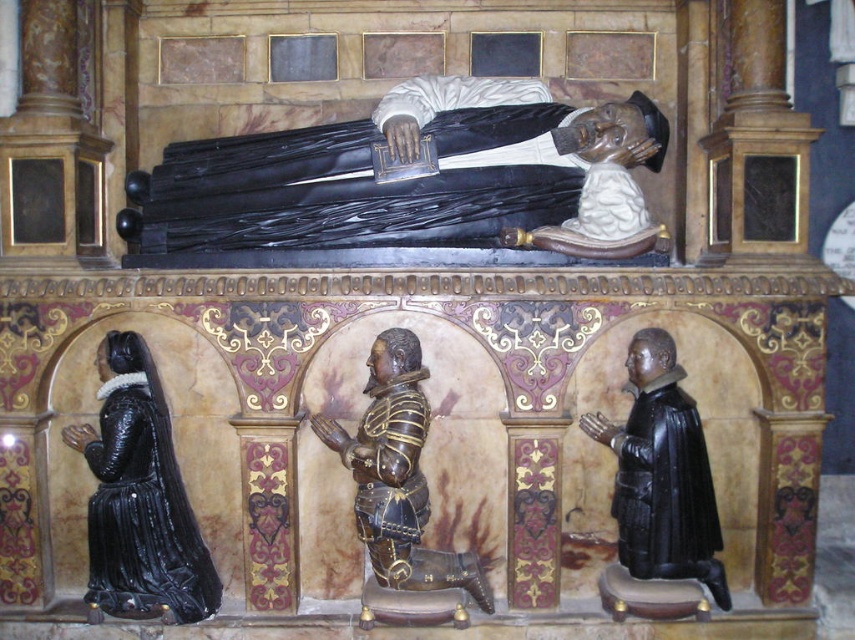
Question: Does black glossy statue at lower left have a smaller size compared to black polished wood statue at center?

Choices:
 (A) yes
 (B) no

Answer: (B)

Question: Among these points, which one is nearest to the camera?

Choices:
 (A) (174, 593)
 (B) (133, 243)

Answer: (A)

Question: Which point is farther to the camera?

Choices:
 (A) (349, 435)
 (B) (155, 548)

Answer: (A)

Question: Does black glossy statue at lower left appear under black polished wood statue at center?

Choices:
 (A) no
 (B) yes

Answer: (B)

Question: Which of these objects is positioned closest to the matte black statue at center?

Choices:
 (A) black polished wood statue at center
 (B) black glossy statue at lower left

Answer: (B)

Question: Can you confirm if matte black statue at center is smaller than black polished wood statue at center?

Choices:
 (A) no
 (B) yes

Answer: (A)